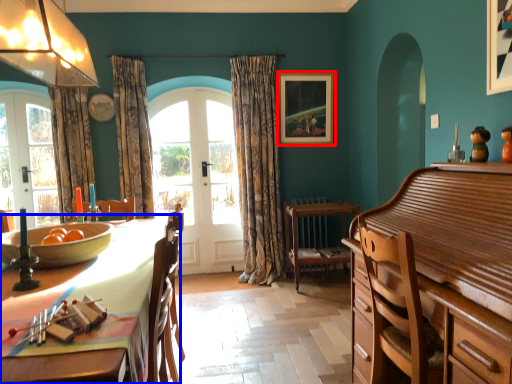
Question: Which point is closer to the camera, picture frame (highlighted by a red box) or table (highlighted by a blue box)?

Choices:
 (A) picture frame
 (B) table

Answer: (B)